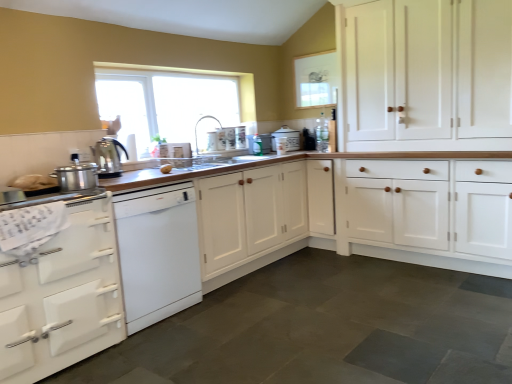
Question: From the image's perspective, would you say white matte cabinet at center, acting as the 2th cabinetry starting from the right, is shown under yellow matte potato at center?

Choices:
 (A) no
 (B) yes

Answer: (B)

Question: Does white matte cabinet at center, acting as the 2th cabinetry starting from the right, appear on the left side of yellow matte potato at center?

Choices:
 (A) yes
 (B) no

Answer: (B)

Question: Are white matte cabinet at center, acting as the 2th cabinetry starting from the right, and yellow matte potato at center far apart?

Choices:
 (A) no
 (B) yes

Answer: (A)

Question: Is white matte cabinet at center, acting as the 2th cabinetry starting from the right, oriented towards yellow matte potato at center?

Choices:
 (A) no
 (B) yes

Answer: (A)

Question: Is white matte cabinet at center, acting as the 2th cabinetry starting from the right, surrounding yellow matte potato at center?

Choices:
 (A) no
 (B) yes

Answer: (A)

Question: Is white matte cabinet at center, acting as the 2th cabinetry starting from the right, placed right next to yellow matte potato at center?

Choices:
 (A) no
 (B) yes

Answer: (A)

Question: From a real-world perspective, is white ceramic bread bin at center, the first appliance in the back-to-front sequence, positioned over white glossy dishwasher at left based on gravity?

Choices:
 (A) yes
 (B) no

Answer: (A)

Question: Considering the relative positions of white ceramic bread bin at center, positioned as the 1th appliance in right-to-left order, and white glossy dishwasher at left in the image provided, is white ceramic bread bin at center, positioned as the 1th appliance in right-to-left order, to the left of white glossy dishwasher at left from the viewer's perspective?

Choices:
 (A) yes
 (B) no

Answer: (B)

Question: Is white ceramic bread bin at center, the first appliance in the back-to-front sequence, looking in the opposite direction of white glossy dishwasher at left?

Choices:
 (A) yes
 (B) no

Answer: (B)

Question: From the image's perspective, is white ceramic bread bin at center, the fourth appliance positioned from the front, below white glossy dishwasher at left?

Choices:
 (A) yes
 (B) no

Answer: (B)

Question: From a real-world perspective, is white ceramic bread bin at center, the fourth appliance positioned from the front, below white glossy dishwasher at left?

Choices:
 (A) yes
 (B) no

Answer: (B)

Question: Can you confirm if white ceramic bread bin at center, which ranks as the 4th appliance in left-to-right order, is wider than white glossy dishwasher at left?

Choices:
 (A) yes
 (B) no

Answer: (B)

Question: Is white wood cabinet at right, marked as the 1th cabinetry in a right-to-left arrangement, far from white glossy dishwasher at left?

Choices:
 (A) no
 (B) yes

Answer: (B)